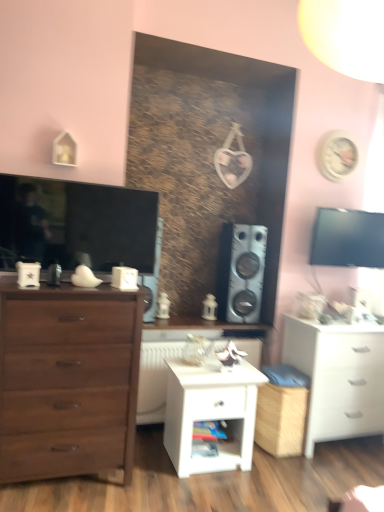
At what (x,y) coordinates should I click in order to perform the action: click on free space that is in between matte brown chest of drawers at left, which ranks as the 2th chest of drawers in back-to-front order, and white glossy nightstand at center. Please return your answer as a coordinate pair (x, y). Image resolution: width=384 pixels, height=512 pixels. Looking at the image, I should click on (150, 461).